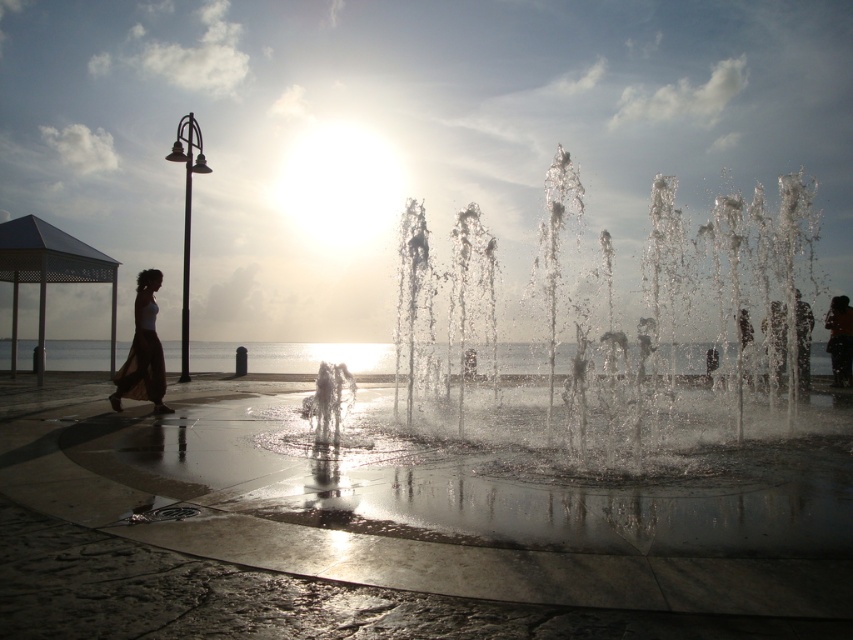
Question: Does clear water at center appear over silhouette skirt at left?

Choices:
 (A) yes
 (B) no

Answer: (B)

Question: Among these objects, which one is nearest to the camera?

Choices:
 (A) clear water at center
 (B) silhouette skirt at left

Answer: (A)

Question: Among these objects, which one is nearest to the camera?

Choices:
 (A) silhouette skirt at left
 (B) clear water at center

Answer: (B)

Question: Does clear water at center have a greater width compared to silhouette skirt at left?

Choices:
 (A) no
 (B) yes

Answer: (B)

Question: Can you confirm if clear water at center is smaller than silhouette skirt at left?

Choices:
 (A) yes
 (B) no

Answer: (B)